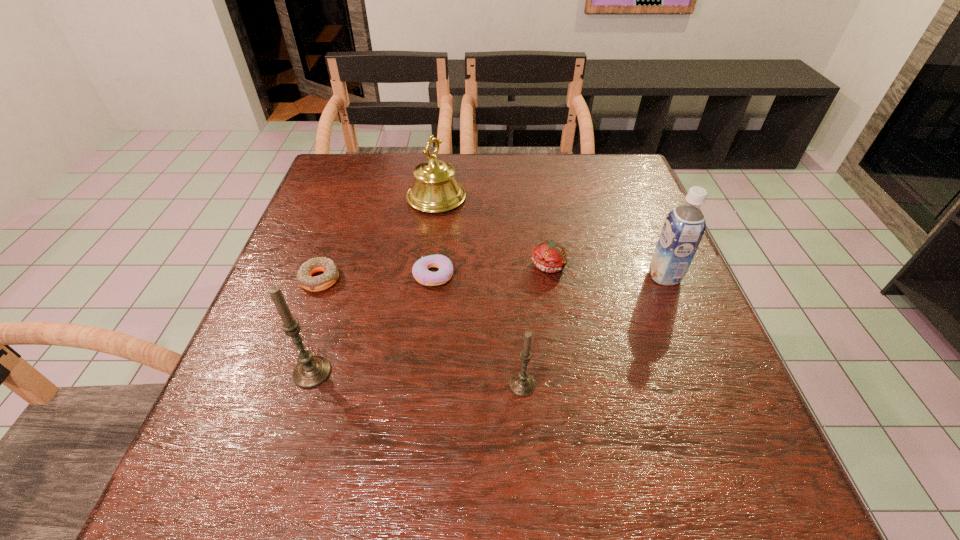
Where is `the taller candle`? the taller candle is located at coordinates (311, 370).

You are a GUI agent. You are given a task and a screenshot of the screen. Output one action in this format:
    pyautogui.click(x=<x>, y=<y>)
    Task: Click on the fourth shortest object
    Image resolution: width=960 pixels, height=540 pixels.
    Given the screenshot: What is the action you would take?
    pyautogui.click(x=521, y=384)

This screenshot has width=960, height=540. Identify the location of the right candle. (521, 384).

Where is `the third tallest object`? Image resolution: width=960 pixels, height=540 pixels. the third tallest object is located at coordinates (435, 189).

At what (x,y) coordinates should I click in order to perform the action: click on bell. Please return your answer as a coordinate pair (x, y). Looking at the image, I should click on (435, 189).

Locate an element on the screen. Image resolution: width=960 pixels, height=540 pixels. the left doughnut is located at coordinates (330, 276).

In order to click on tomato in this screenshot , I will do `click(549, 256)`.

At what (x,y) coordinates should I click in order to perform the action: click on the fifth tallest object. Please return your answer as a coordinate pair (x, y). Image resolution: width=960 pixels, height=540 pixels. Looking at the image, I should click on (549, 256).

You are a GUI agent. You are given a task and a screenshot of the screen. Output one action in this format:
    pyautogui.click(x=<x>, y=<y>)
    Task: Click on the right doughnut
    
    Given the screenshot: What is the action you would take?
    pyautogui.click(x=420, y=271)

Where is `the rightmost object`? The image size is (960, 540). the rightmost object is located at coordinates (683, 229).